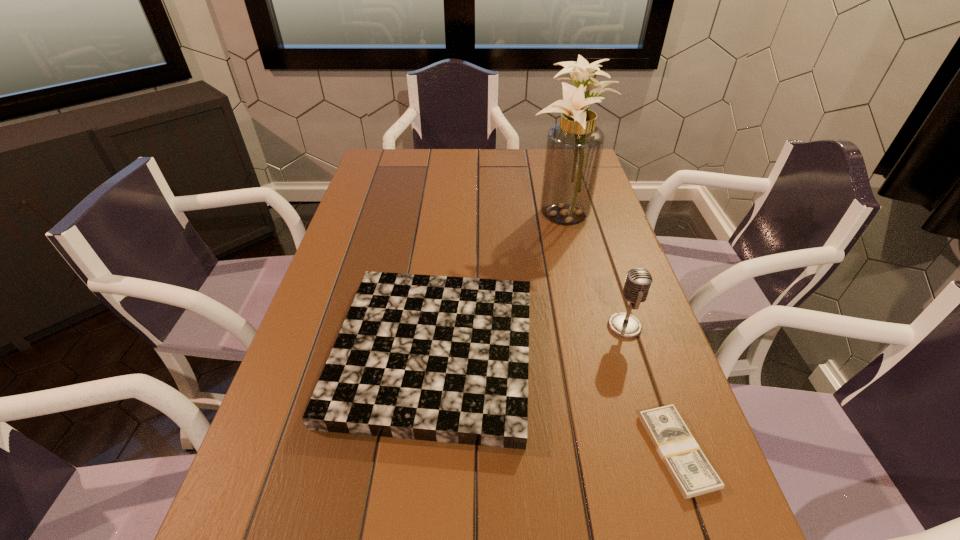
Find the location of a particular element. The image size is (960, 540). object that is at the left edge is located at coordinates (437, 358).

At what (x,y) coordinates should I click in order to perform the action: click on flower arrangement that is at the right edge. Please return your answer as a coordinate pair (x, y). Looking at the image, I should click on (574, 147).

Identify the location of microphone that is at the right edge. Image resolution: width=960 pixels, height=540 pixels. (638, 282).

Image resolution: width=960 pixels, height=540 pixels. Identify the location of dollar positioned at the right edge. (692, 473).

You are a GUI agent. You are given a task and a screenshot of the screen. Output one action in this format:
    pyautogui.click(x=<x>, y=<y>)
    Task: Click on the vacant space at the far edge of the desktop
    This screenshot has height=540, width=960.
    Given the screenshot: What is the action you would take?
    pyautogui.click(x=447, y=157)

What are the coordinates of `free region at the left edge of the desktop` in the screenshot? It's located at (368, 197).

Where is `vacant space at the right edge`? vacant space at the right edge is located at coordinates click(612, 226).

Identify the location of vacant region at the far left corner of the desktop. The height and width of the screenshot is (540, 960). (379, 164).

Locate an element on the screen. free space between the dollar and the microphone is located at coordinates (651, 389).

This screenshot has height=540, width=960. I want to click on vacant area that lies between the checkerboard and the dollar, so click(x=555, y=402).